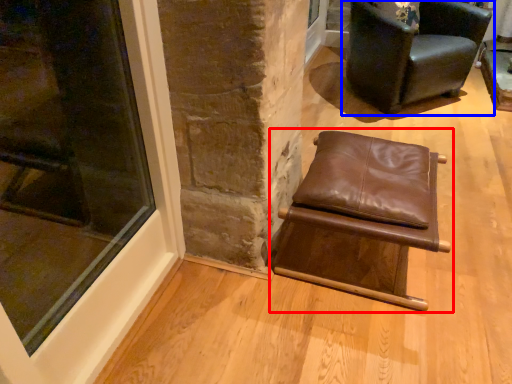
Question: Among these objects, which one is nearest to the camera, chair (highlighted by a red box) or chair (highlighted by a blue box)?

Choices:
 (A) chair
 (B) chair

Answer: (A)